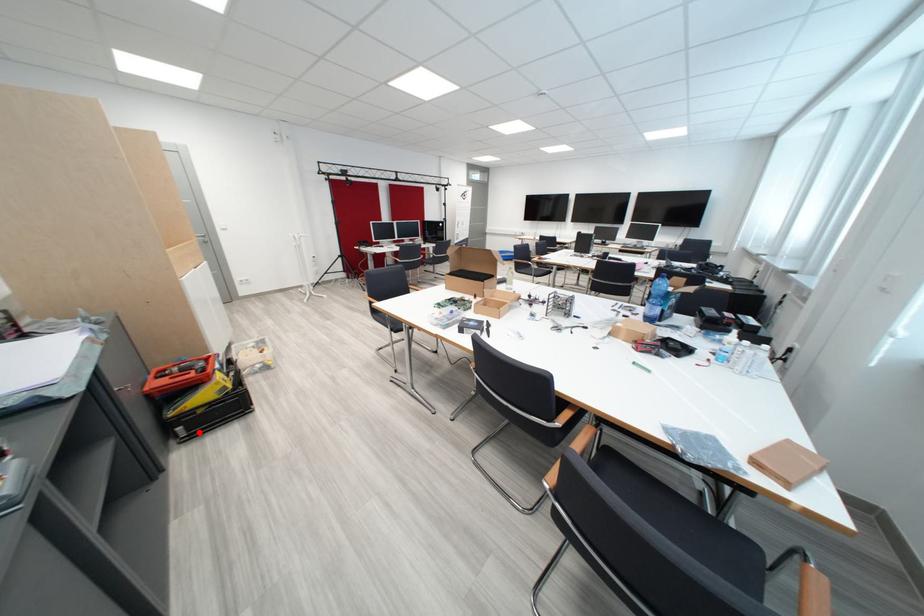
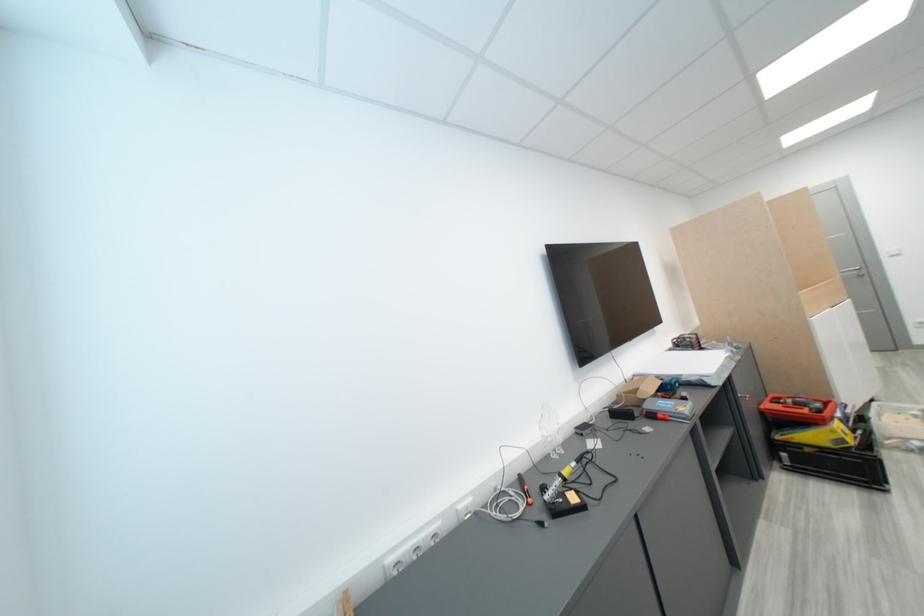
Find the pixel in the second image that matches the highlighted location in the first image.

(803, 463)